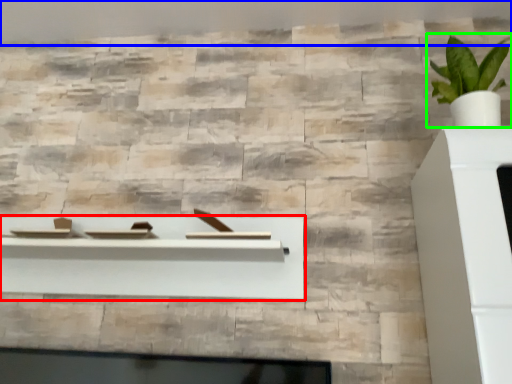
Question: Which object is the closest to the shelf (highlighted by a red box)? Choose among these: backdrop (highlighted by a blue box) or houseplant (highlighted by a green box).

Choices:
 (A) backdrop
 (B) houseplant

Answer: (B)